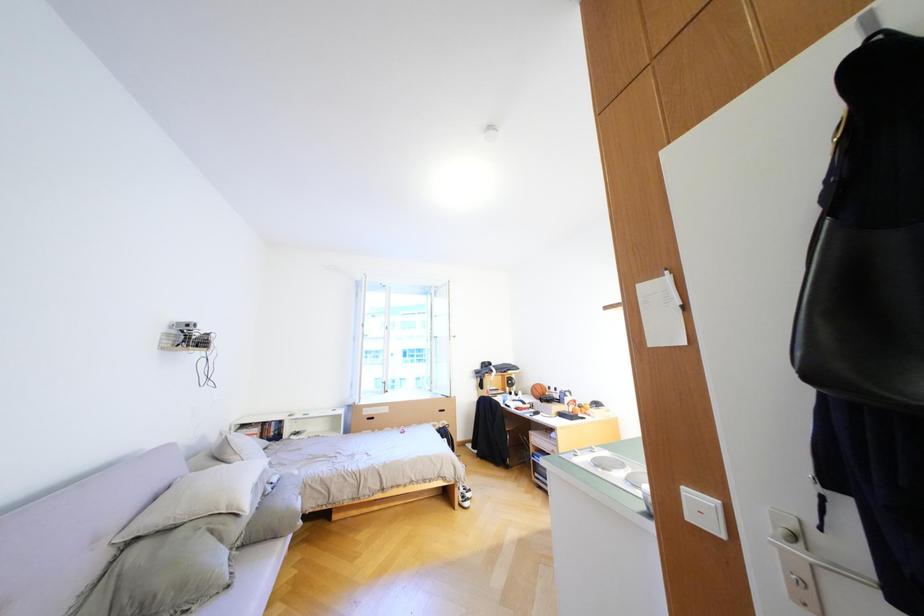
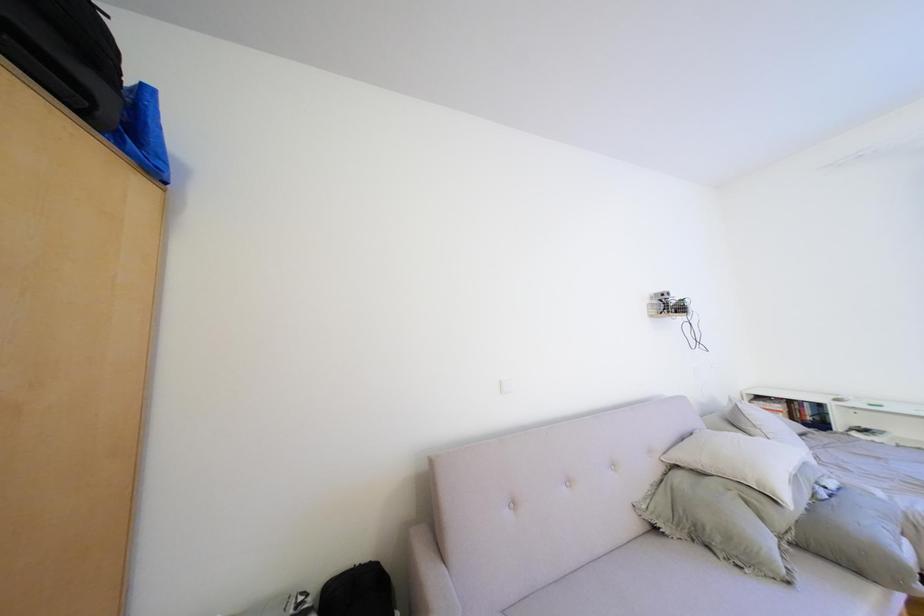
Question: The camera is either moving clockwise (left) or counter-clockwise (right) around the object. The first image is from the beginning of the video and the second image is from the end. Is the camera moving left or right when shooting the video?

Choices:
 (A) Left
 (B) Right

Answer: (B)